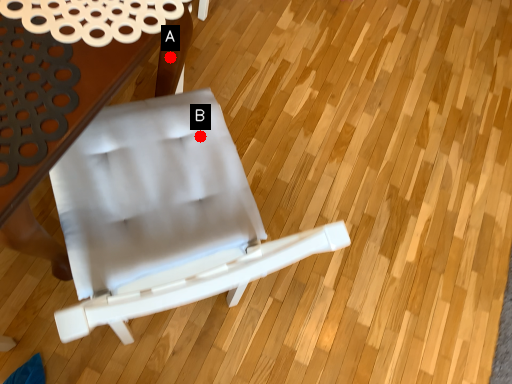
Question: Two points are circled on the image, labeled by A and B beside each circle. Which point is closer to the camera taking this photo?

Choices:
 (A) A is closer
 (B) B is closer

Answer: (B)